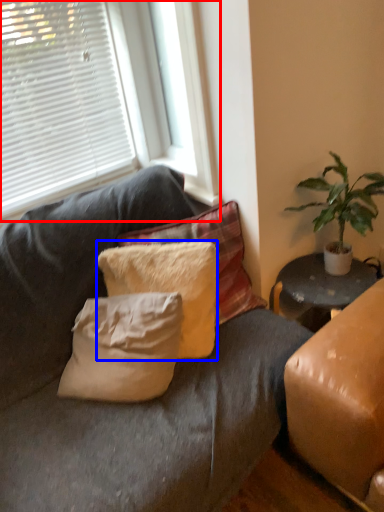
Question: Which object appears farthest to the camera in this image, window (highlighted by a red box) or pillow (highlighted by a blue box)?

Choices:
 (A) window
 (B) pillow

Answer: (B)